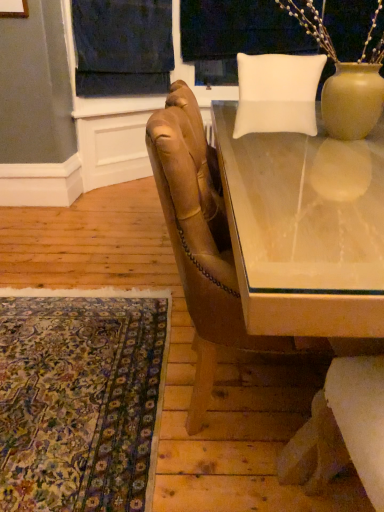
What do you see at coordinates (122, 47) in the screenshot? I see `dark blue fabric at upper center` at bounding box center [122, 47].

What is the approximate height of dark blue fabric at upper center?

28.95 inches.

What is the approximate height of carpet with intricate patterns at lower left?

carpet with intricate patterns at lower left is 0.90 inches in height.

Where is `dark blue fabric at upper center`? dark blue fabric at upper center is located at coordinates (122, 47).

Between dark blue fabric at upper center and white fabric at upper center, which one appears on the left side from the viewer's perspective?

dark blue fabric at upper center.

Find the location of a particular element. The image size is (384, 512). curtain on the left of white fabric at upper center is located at coordinates (122, 47).

Is dark blue fabric at upper center next to white fabric at upper center?

dark blue fabric at upper center is not next to white fabric at upper center, and they're not touching.

Can you tell me how much dark blue fabric at upper center and white fabric at upper center differ in facing direction?

The angular difference between dark blue fabric at upper center and white fabric at upper center is 45.1 degrees.

Considering the positions of point (53, 346) and point (371, 297), is point (53, 346) closer or farther from the camera than point (371, 297)?

Point (53, 346) is farther from the camera than point (371, 297).

Based on the photo, is carpet with intricate patterns at lower left completely or partially outside of clear glass table at center?

Yes.

Is clear glass table at center at the back of carpet with intricate patterns at lower left?

No.

From a real-world perspective, who is located lower, carpet with intricate patterns at lower left or clear glass table at center?

From a 3D spatial view, carpet with intricate patterns at lower left is below.

Is carpet with intricate patterns at lower left surrounded by clear glass table at center?

Definitely not — carpet with intricate patterns at lower left is not inside clear glass table at center.

Find the location of `mat on the left of the clear glass table at center`. mat on the left of the clear glass table at center is located at coordinates (81, 398).

How distant is clear glass table at center from carpet with intricate patterns at lower left?

clear glass table at center and carpet with intricate patterns at lower left are 33.83 inches apart from each other.

Considering their positions, is clear glass table at center located in front of or behind carpet with intricate patterns at lower left?

clear glass table at center is in front of carpet with intricate patterns at lower left.

Can you confirm if dark blue fabric at upper center is smaller than leather armchair at center?

Yes, dark blue fabric at upper center is smaller than leather armchair at center.

Can you tell me how much dark blue fabric at upper center and leather armchair at center differ in facing direction?

There is a 45.3-degree angle between the facing directions of dark blue fabric at upper center and leather armchair at center.

Between dark blue fabric at upper center and leather armchair at center, which one has smaller width?

With smaller width is dark blue fabric at upper center.

Is there a large distance between dark blue fabric at upper center and leather armchair at center?

Yes, dark blue fabric at upper center and leather armchair at center are quite far apart.

Between dark blue fabric at upper center and carpet with intricate patterns at lower left, which one has larger width?

carpet with intricate patterns at lower left.

From the image's perspective, which is below, dark blue fabric at upper center or carpet with intricate patterns at lower left?

carpet with intricate patterns at lower left.

Looking at this image, which object is closer to the camera, dark blue fabric at upper center or carpet with intricate patterns at lower left?

carpet with intricate patterns at lower left is in front.

I want to click on curtain lying above the carpet with intricate patterns at lower left (from the image's perspective), so click(122, 47).

Identify the location of mat that is below the leather armchair at center (from the image's perspective). (81, 398).

Is carpet with intricate patterns at lower left inside or outside of leather armchair at center?

carpet with intricate patterns at lower left is not inside leather armchair at center, it's outside.

Are carpet with intricate patterns at lower left and leather armchair at center located far from each other?

That's not correct — carpet with intricate patterns at lower left is a little close to leather armchair at center.

From the image's perspective, relative to leather armchair at center, is carpet with intricate patterns at lower left above or below?

carpet with intricate patterns at lower left is below leather armchair at center.

Locate an element on the screen. Image resolution: width=384 pixels, height=512 pixels. table above the leather armchair at center (from the image's perspective) is located at coordinates (335, 297).

Considering the relative positions of leather armchair at center and clear glass table at center in the image provided, is leather armchair at center to the right of clear glass table at center from the viewer's perspective?

Incorrect, leather armchair at center is not on the right side of clear glass table at center.

Is leather armchair at center inside the boundaries of clear glass table at center, or outside?

leather armchair at center is spatially positioned inside clear glass table at center.

Does leather armchair at center have a greater width compared to clear glass table at center?

No, leather armchair at center is not wider than clear glass table at center.

The height and width of the screenshot is (512, 384). What are the coordinates of `window screen on the right of dark blue fabric at upper center` in the screenshot? It's located at (236, 36).

Where is `mat that appears behind the clear glass table at center`? mat that appears behind the clear glass table at center is located at coordinates (81, 398).

From the image, which object appears to be farther from carpet with intricate patterns at lower left, white fabric at upper center or clear glass table at center?

The object further to carpet with intricate patterns at lower left is white fabric at upper center.

Estimate the real-world distances between objects in this image. Which object is further from white fabric at upper center, clear glass table at center or carpet with intricate patterns at lower left?

carpet with intricate patterns at lower left.

Estimate the real-world distances between objects in this image. Which object is closer to clear glass table at center, leather armchair at center or carpet with intricate patterns at lower left?

leather armchair at center is positioned closer to the anchor clear glass table at center.

Looking at the image, which one is located closer to white fabric at upper center, leather armchair at center or clear glass table at center?

Among the two, leather armchair at center is located nearer to white fabric at upper center.

Based on their spatial positions, is dark blue fabric at upper center or carpet with intricate patterns at lower left closer to clear glass table at center?

carpet with intricate patterns at lower left lies closer to clear glass table at center than the other object.

Consider the image. Looking at the image, which one is located further to white fabric at upper center, leather armchair at center or dark blue fabric at upper center?

Among the two, leather armchair at center is located further to white fabric at upper center.

Based on the photo, considering their positions, is white fabric at upper center positioned further to carpet with intricate patterns at lower left than leather armchair at center?

white fabric at upper center.

Estimate the real-world distances between objects in this image. Which object is further from dark blue fabric at upper center, carpet with intricate patterns at lower left or leather armchair at center?

carpet with intricate patterns at lower left lies further to dark blue fabric at upper center than the other object.

The image size is (384, 512). Identify the location of chair between clear glass table at center and white fabric at upper center along the z-axis. (203, 242).

Where is `chair between dark blue fabric at upper center and carpet with intricate patterns at lower left vertically`? Image resolution: width=384 pixels, height=512 pixels. chair between dark blue fabric at upper center and carpet with intricate patterns at lower left vertically is located at coordinates (203, 242).

Locate an element on the screen. The height and width of the screenshot is (512, 384). chair between clear glass table at center and dark blue fabric at upper center from front to back is located at coordinates (203, 242).

You are a GUI agent. You are given a task and a screenshot of the screen. Output one action in this format:
    pyautogui.click(x=<x>, y=<y>)
    Task: Click on the mat located between clear glass table at center and white fabric at upper center in the depth direction
    The image size is (384, 512).
    Given the screenshot: What is the action you would take?
    pyautogui.click(x=81, y=398)